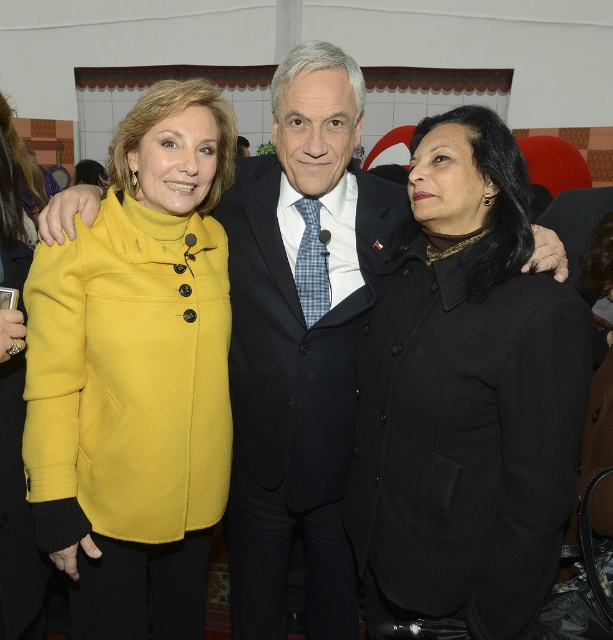
Can you confirm if black wool coat at center is bigger than yellow woolen coat at left?

No.

Who is positioned more to the left, black wool coat at center or yellow woolen coat at left?

From the viewer's perspective, yellow woolen coat at left appears more on the left side.

Between point (485, 321) and point (153, 474), which one is positioned in front?

Point (485, 321) is in front.

Find the location of a particular element. This screenshot has height=640, width=613. black wool coat at center is located at coordinates (466, 396).

The image size is (613, 640). Identify the location of black wool coat at center. (466, 396).

Between point (443, 468) and point (267, 573), which one is positioned behind?

The point (267, 573) is more distant.

Locate an element on the screen. The image size is (613, 640). black wool coat at center is located at coordinates (466, 396).

The width and height of the screenshot is (613, 640). Identify the location of black wool coat at center. (466, 396).

Can you confirm if yellow woolen coat at left is taller than dark blue wool suit at center?

Yes.

Who is lower down, yellow woolen coat at left or dark blue wool suit at center?

dark blue wool suit at center is below.

Does point (51, 316) come behind point (305, 410)?

No, (51, 316) is closer to viewer.

Where is `yellow woolen coat at left`? The width and height of the screenshot is (613, 640). yellow woolen coat at left is located at coordinates click(x=135, y=374).